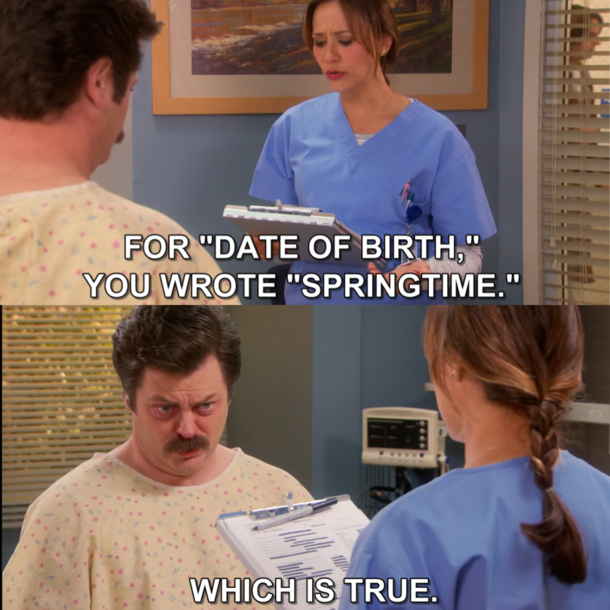
You are a GUI agent. You are given a task and a screenshot of the screen. Output one action in this format:
    pyautogui.click(x=<x>, y=<y>)
    Task: Click on the back wall empty space
    
    Given the screenshot: What is the action you would take?
    pyautogui.click(x=171, y=144), pyautogui.click(x=238, y=149), pyautogui.click(x=195, y=198), pyautogui.click(x=508, y=195), pyautogui.click(x=504, y=63), pyautogui.click(x=387, y=388), pyautogui.click(x=325, y=329), pyautogui.click(x=263, y=384), pyautogui.click(x=325, y=468)